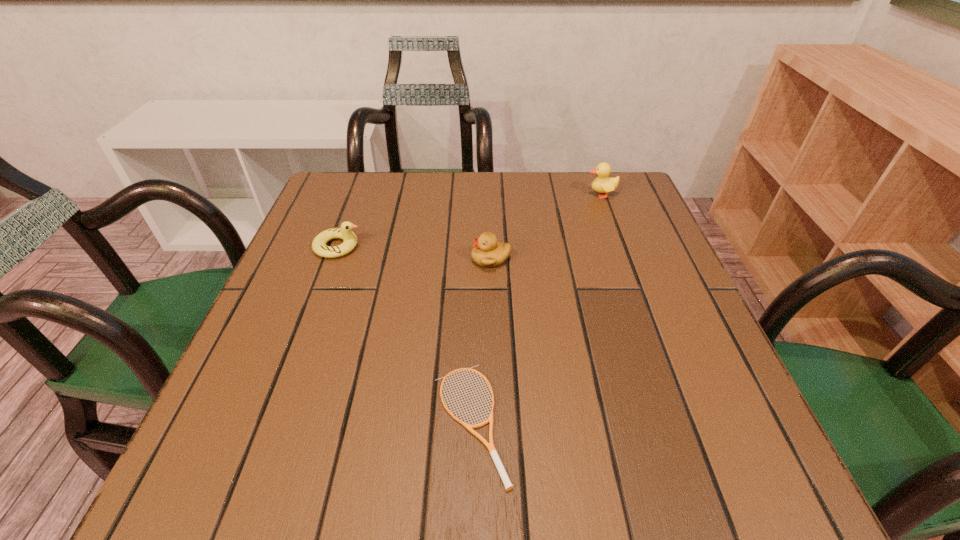
I want to click on the tallest object, so click(602, 184).

You are a GUI agent. You are given a task and a screenshot of the screen. Output one action in this format:
    pyautogui.click(x=<x>, y=<y>)
    Task: Click on the farthest duckling
    The image size is (960, 540).
    Given the screenshot: What is the action you would take?
    pyautogui.click(x=602, y=184)

The image size is (960, 540). I want to click on the second duckling from left to right, so click(487, 252).

At what (x,y) coordinates should I click in order to perform the action: click on the leftmost object. Please return your answer as a coordinate pair (x, y). Looking at the image, I should click on (319, 246).

Where is `the nearest object`? The image size is (960, 540). the nearest object is located at coordinates (490, 446).

The height and width of the screenshot is (540, 960). I want to click on tennis racket, so click(x=490, y=446).

Where is `vacant space located 0.160m on the front-facing side of the rightmost object`? This screenshot has width=960, height=540. vacant space located 0.160m on the front-facing side of the rightmost object is located at coordinates (523, 194).

Locate an element on the screen. vacant position located 0.330m on the front-facing side of the rightmost object is located at coordinates (457, 194).

Locate an element on the screen. The width and height of the screenshot is (960, 540). vacant region located 0.150m on the front-facing side of the rightmost object is located at coordinates (527, 194).

This screenshot has width=960, height=540. I want to click on free space located 0.060m at the beak of the second duckling from right to left, so click(444, 259).